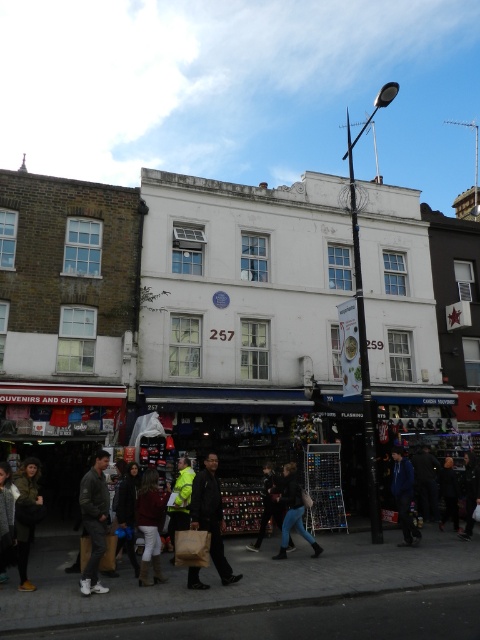
Question: Which of these objects is positioned farthest from the brown paper bags at lower left?

Choices:
 (A) dark brown leather jacket at center
 (B) black leather jacket at center

Answer: (A)

Question: Which of the following is the closest to the observer?

Choices:
 (A) (218, 513)
 (B) (268, 504)

Answer: (A)

Question: Among these points, which one is nearest to the camera?

Choices:
 (A) (284, 561)
 (B) (130, 474)
 (C) (292, 490)
 (D) (447, 497)

Answer: (A)

Question: Observing the image, what is the correct spatial positioning of leather jacket at lower left in reference to dark blue jacket at center?

Choices:
 (A) below
 (B) above

Answer: (B)

Question: Is dark brown leather jacket at center positioned behind khaki fabric pants at lower left?

Choices:
 (A) yes
 (B) no

Answer: (A)

Question: Does dark brown leather jacket at lower center appear under dark blue jacket at center?

Choices:
 (A) yes
 (B) no

Answer: (B)